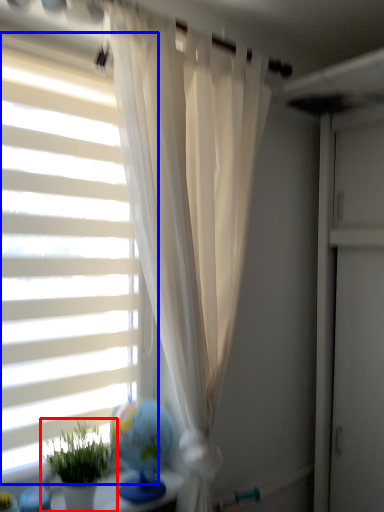
Question: Which point is closer to the camera, houseplant (highlighted by a red box) or window blind (highlighted by a blue box)?

Choices:
 (A) houseplant
 (B) window blind

Answer: (A)